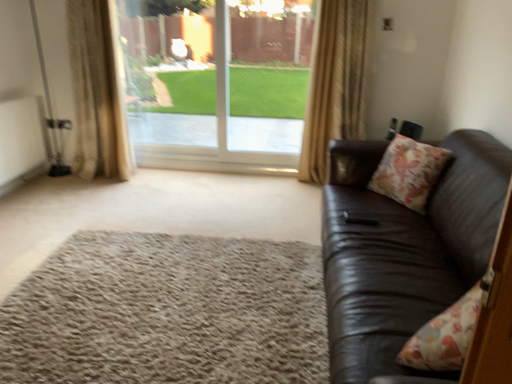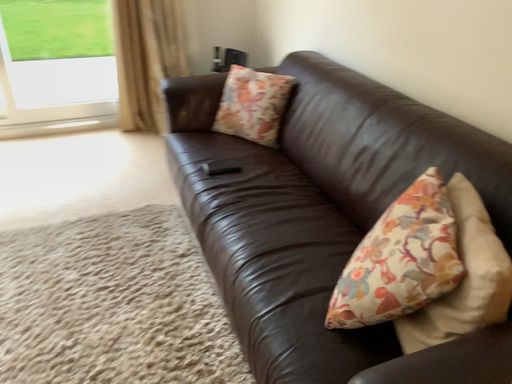
Question: Which way did the camera rotate in the video?

Choices:
 (A) rotated right
 (B) rotated left

Answer: (A)